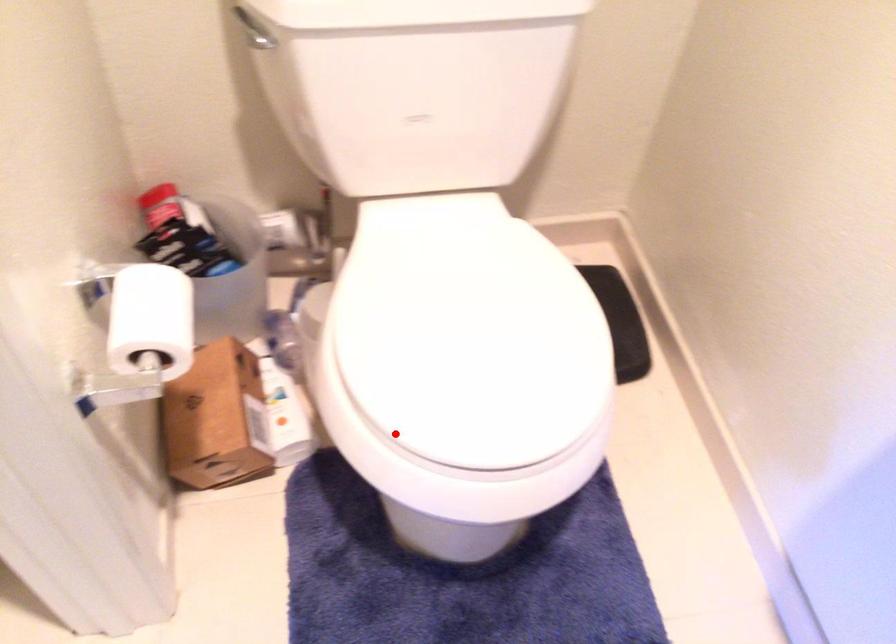
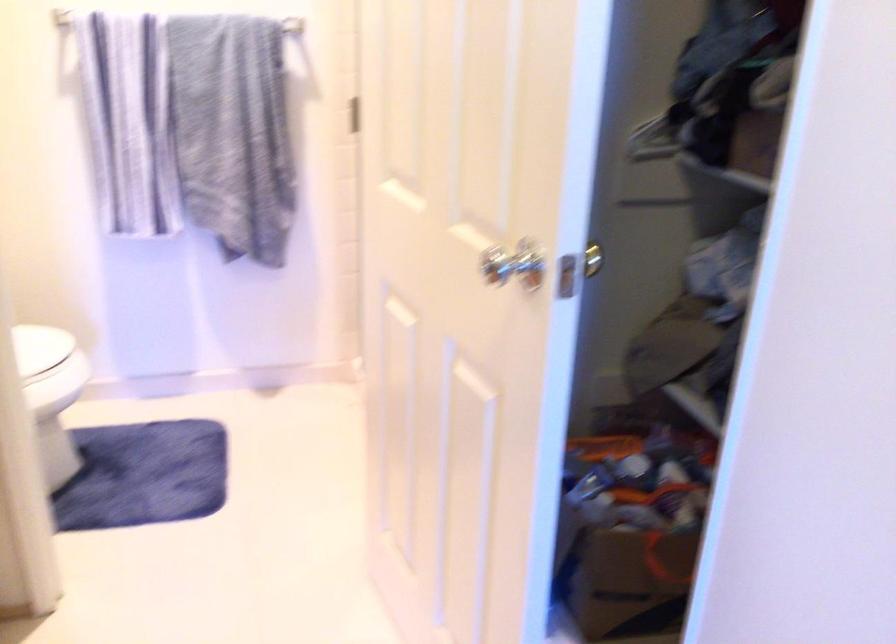
The point at the highlighted location is marked in the first image. Where is the corresponding point in the second image?

(45, 368)